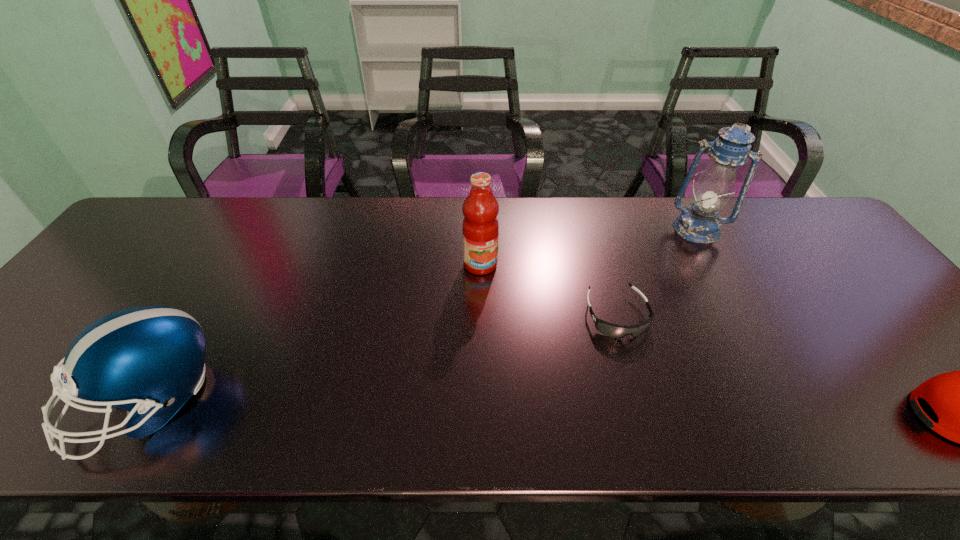
The width and height of the screenshot is (960, 540). What are the coordinates of `free point located on the front label of the fourth nearest object` in the screenshot? It's located at (542, 352).

Where is `vacant space located 0.090m on the front and sides of the third nearest object`? This screenshot has width=960, height=540. vacant space located 0.090m on the front and sides of the third nearest object is located at coordinates (641, 374).

Locate an element on the screen. The width and height of the screenshot is (960, 540). vacant space located on the front-facing side of the lantern is located at coordinates [659, 325].

Locate an element on the screen. The image size is (960, 540). free space located 0.390m on the front-facing side of the lantern is located at coordinates (655, 333).

Where is `free space located on the front-facing side of the lantern`? The image size is (960, 540). free space located on the front-facing side of the lantern is located at coordinates tap(666, 303).

The image size is (960, 540). Identify the location of object that is at the far edge. (700, 223).

You are a GUI agent. You are given a task and a screenshot of the screen. Output one action in this format:
    pyautogui.click(x=<x>, y=<y>)
    Task: Click on the object situated at the near edge
    Image resolution: width=960 pixels, height=540 pixels.
    Given the screenshot: What is the action you would take?
    pyautogui.click(x=150, y=360)

Identify the location of blank space at the far edge. (430, 212).

Locate an element on the screen. vacant space at the near edge of the desktop is located at coordinates (232, 389).

This screenshot has height=540, width=960. Find the location of `vacant space at the left edge`. vacant space at the left edge is located at coordinates (79, 326).